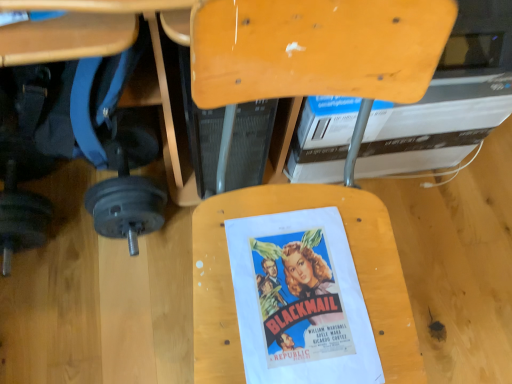
The image size is (512, 384). I want to click on vacant area on top of matte paper movie poster at center (from a real-world perspective), so click(x=303, y=302).